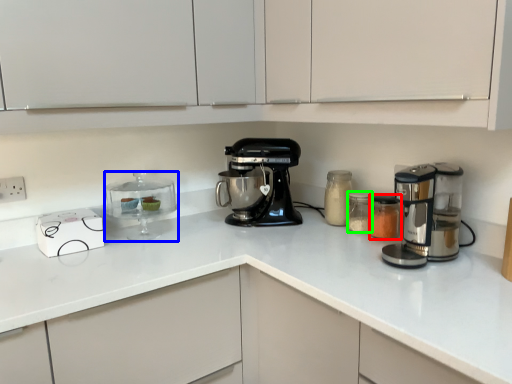
Question: Estimate the real-world distances between objects in this image. Which object is farther from appliance (highlighted by a red box), appliance (highlighted by a blue box) or appliance (highlighted by a green box)?

Choices:
 (A) appliance
 (B) appliance

Answer: (A)